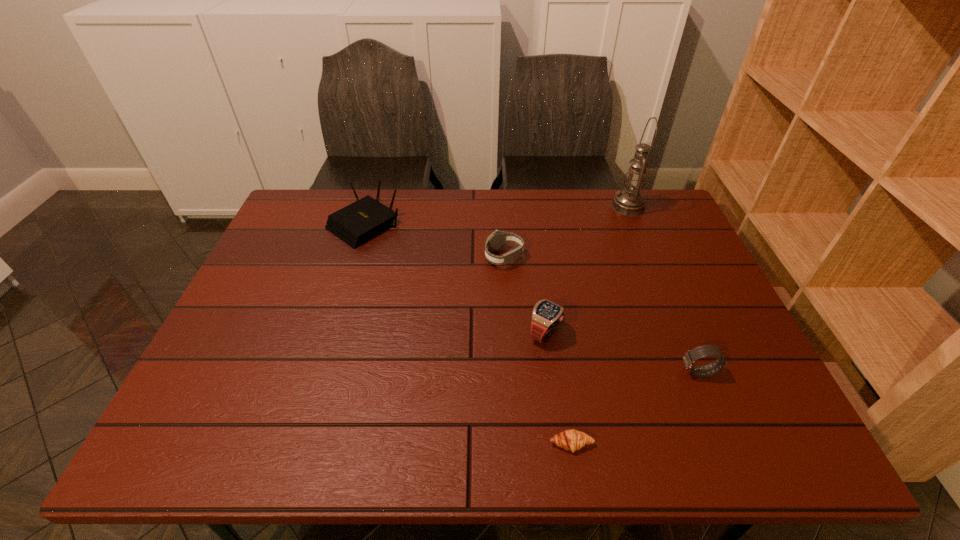
Where is `blank space located on the right of the fourth farthest object`? Image resolution: width=960 pixels, height=540 pixels. blank space located on the right of the fourth farthest object is located at coordinates (586, 333).

Find the location of a particular element. This screenshot has height=540, width=960. free spot located 0.390m on the face of the rightmost watch is located at coordinates (509, 372).

Find the location of a particular element. The height and width of the screenshot is (540, 960). free space located on the face of the rightmost watch is located at coordinates [x=614, y=372].

Identify the location of vacant position located 0.190m on the face of the rightmost watch. The height and width of the screenshot is (540, 960). (597, 372).

What are the coordinates of `vacant space located 0.360m on the face of the farthest watch` in the screenshot? It's located at (361, 258).

Where is `free space located on the face of the farthest watch`? The image size is (960, 540). free space located on the face of the farthest watch is located at coordinates (382, 258).

Identify the location of free space located on the face of the farthest watch. This screenshot has height=540, width=960. (361, 258).

In order to click on oil lamp that is positioned at the far edge in this screenshot , I will do `click(629, 202)`.

Find the location of a particular element. The width and height of the screenshot is (960, 540). router that is at the far edge is located at coordinates (361, 221).

The height and width of the screenshot is (540, 960). Identify the location of object that is positioned at the near edge. (572, 440).